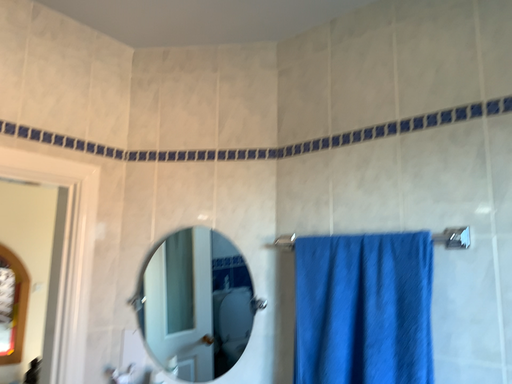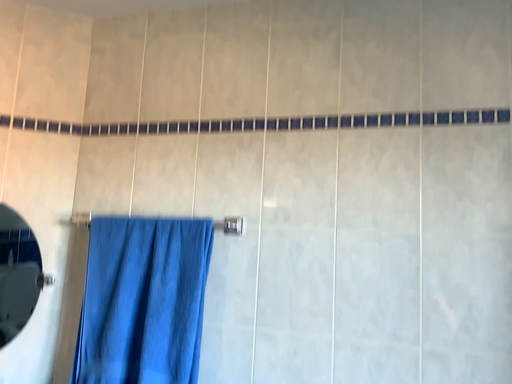
Question: Which way did the camera rotate in the video?

Choices:
 (A) rotated left
 (B) rotated right

Answer: (B)